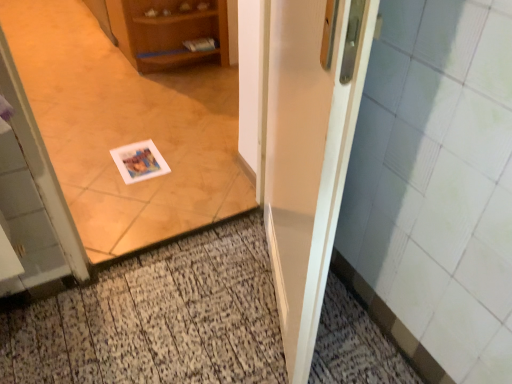
Locate an element on the screen. This screenshot has height=384, width=512. free space behind white paper postcard at center is located at coordinates (160, 130).